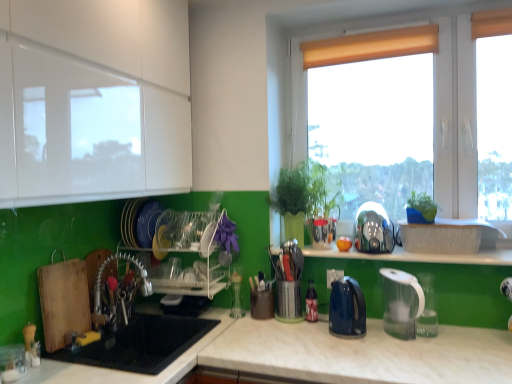
Question: Considering the relative positions of shiny metallic kettle at center-right, which is the 2th appliance in bottom-to-top order, and blue glossy electric kettle at center, the 2th kitchen appliance in the right-to-left sequence, in the image provided, is shiny metallic kettle at center-right, which is the 2th appliance in bottom-to-top order, to the left of blue glossy electric kettle at center, the 2th kitchen appliance in the right-to-left sequence, from the viewer's perspective?

Choices:
 (A) no
 (B) yes

Answer: (A)

Question: Does shiny metallic kettle at center-right, which is counted as the 1th appliance, starting from the top, have a lesser width compared to blue glossy electric kettle at center, which appears as the 1th kitchen appliance when viewed from the left?

Choices:
 (A) yes
 (B) no

Answer: (B)

Question: Considering the relative sizes of shiny metallic kettle at center-right, the second appliance from the left, and blue glossy electric kettle at center, which appears as the 1th kitchen appliance when viewed from the left, in the image provided, is shiny metallic kettle at center-right, the second appliance from the left, shorter than blue glossy electric kettle at center, which appears as the 1th kitchen appliance when viewed from the left,?

Choices:
 (A) yes
 (B) no

Answer: (A)

Question: Is shiny metallic kettle at center-right, the second appliance from the left, positioned behind blue glossy electric kettle at center, the 2th kitchen appliance in the right-to-left sequence?

Choices:
 (A) no
 (B) yes

Answer: (B)

Question: Is blue glossy electric kettle at center, the 2th kitchen appliance in the right-to-left sequence, completely or partially inside shiny metallic kettle at center-right, the 1th appliance from the right?

Choices:
 (A) yes
 (B) no

Answer: (B)

Question: From the image's perspective, is shiny metallic kettle at center-right, the 1th appliance from the right, below blue glossy electric kettle at center, the 2th kitchen appliance in the right-to-left sequence?

Choices:
 (A) yes
 (B) no

Answer: (B)

Question: Can you confirm if matte white window at upper right is taller than shiny metallic kettle at center-right, the 1th appliance from the right?

Choices:
 (A) no
 (B) yes

Answer: (B)

Question: Considering the relative positions of matte white window at upper right and shiny metallic kettle at center-right, the 1th appliance from the right, in the image provided, is matte white window at upper right in front of shiny metallic kettle at center-right, the 1th appliance from the right,?

Choices:
 (A) yes
 (B) no

Answer: (B)

Question: Does matte white window at upper right appear on the left side of shiny metallic kettle at center-right, the second appliance from the left?

Choices:
 (A) yes
 (B) no

Answer: (B)

Question: Can we say matte white window at upper right lies outside shiny metallic kettle at center-right, which is the 2th appliance in bottom-to-top order?

Choices:
 (A) no
 (B) yes

Answer: (B)

Question: Does matte white window at upper right have a lesser width compared to shiny metallic kettle at center-right, which is counted as the 1th appliance, starting from the top?

Choices:
 (A) no
 (B) yes

Answer: (B)

Question: From the image's perspective, is matte white window at upper right below shiny metallic kettle at center-right, the second appliance from the left?

Choices:
 (A) yes
 (B) no

Answer: (B)

Question: Are green plastic plant at right, arranged as the 1th plant when viewed from the right, and shiny metallic kettle at center-right, the second appliance from the left, making contact?

Choices:
 (A) no
 (B) yes

Answer: (A)